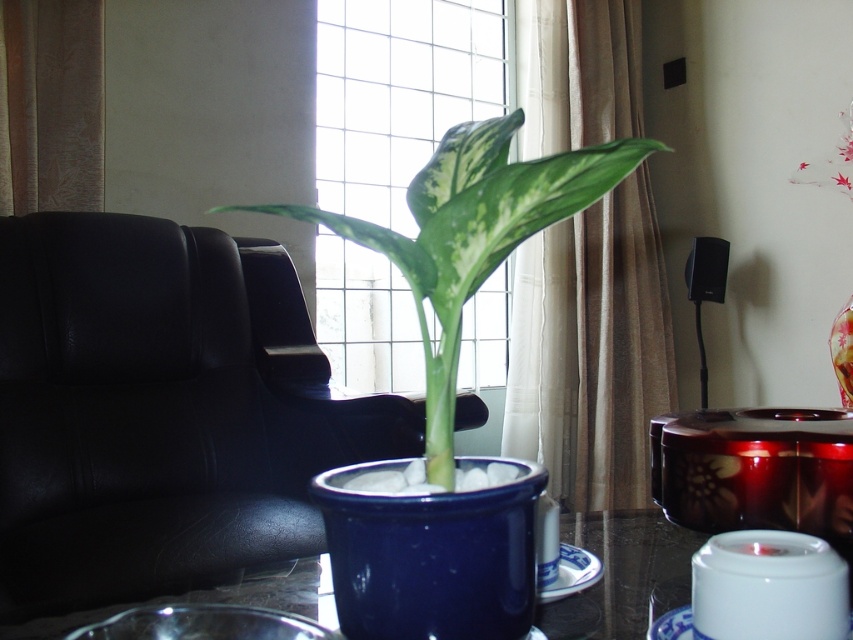
Question: Is blue ceramic vase at center bigger than matte red flower at upper right?

Choices:
 (A) yes
 (B) no

Answer: (B)

Question: Considering the real-world distances, which object is farthest from the glossy ceramic table at center?

Choices:
 (A) blue ceramic vase at center
 (B) transparent glass vase at upper right

Answer: (B)

Question: Which point is farther to the camera?

Choices:
 (A) glossy ceramic table at center
 (B) blue ceramic vase at center
 (C) matte red flower at upper right

Answer: (C)

Question: Can you confirm if green glossy leaf at center is positioned above blue ceramic vase at center?

Choices:
 (A) yes
 (B) no

Answer: (A)

Question: Estimate the real-world distances between objects in this image. Which object is closer to the glossy ceramic table at center?

Choices:
 (A) green glossy leaf at center
 (B) blue ceramic vase at center
 (C) transparent glass vase at upper right
 (D) matte red flower at upper right

Answer: (B)

Question: Does matte red flower at upper right appear on the right side of transparent glass vase at upper right?

Choices:
 (A) no
 (B) yes

Answer: (B)